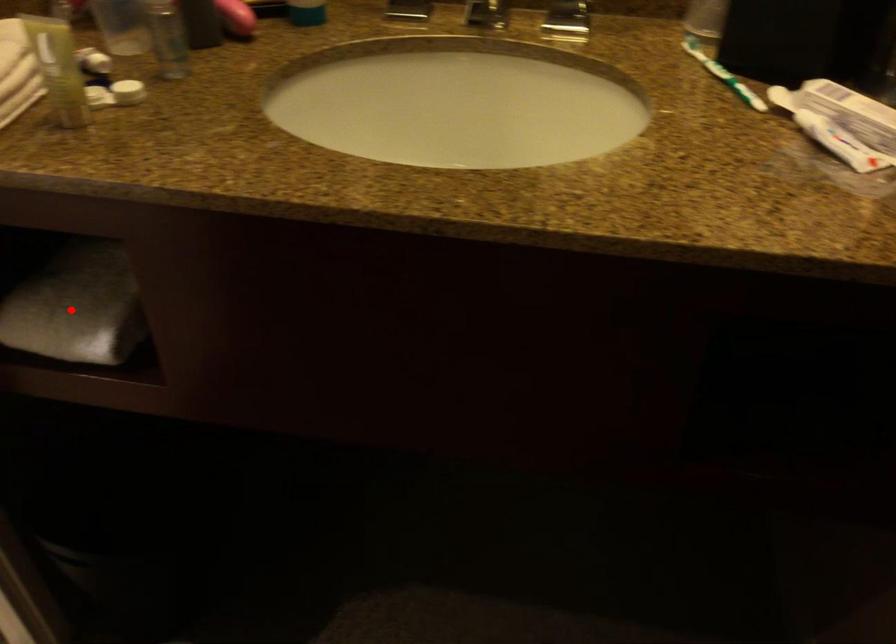
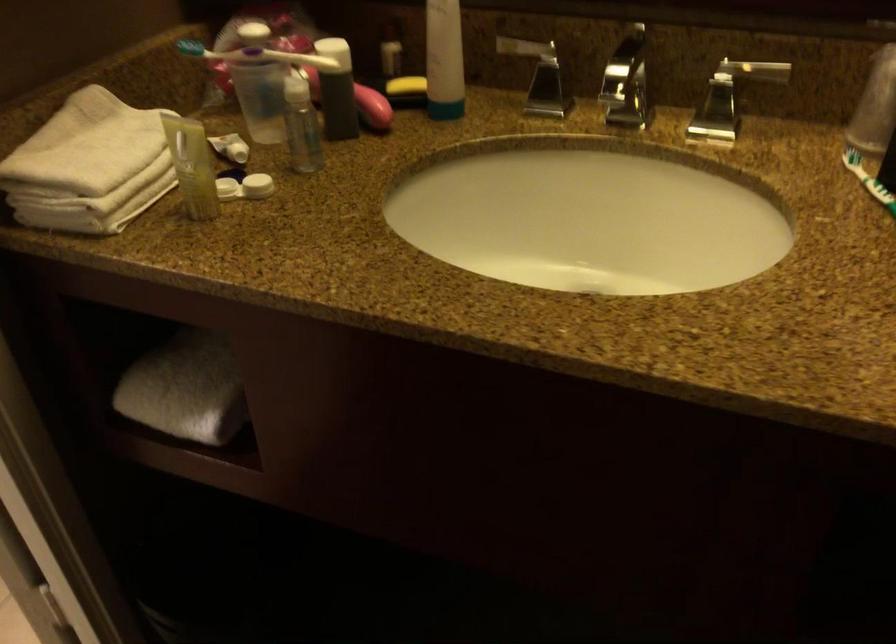
Find the pixel in the second image that matches the highlighted location in the first image.

(185, 389)